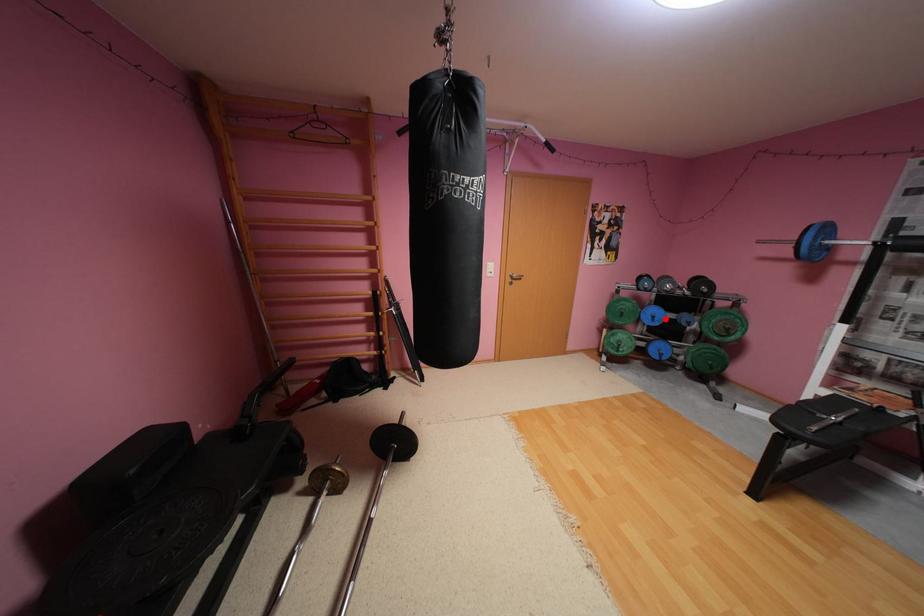
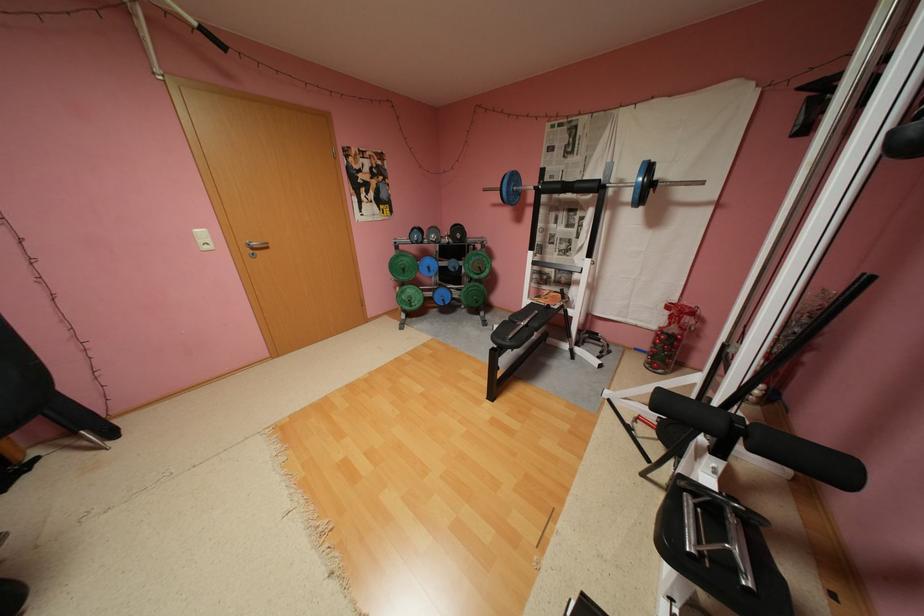
Question: I am providing you with two images of the same scene from different viewpoints. Given a red point in image1, look at the same physical point in image2. Is it:

Choices:
 (A) Closer to the viewpoint
 (B) Farther from the viewpoint

Answer: (A)